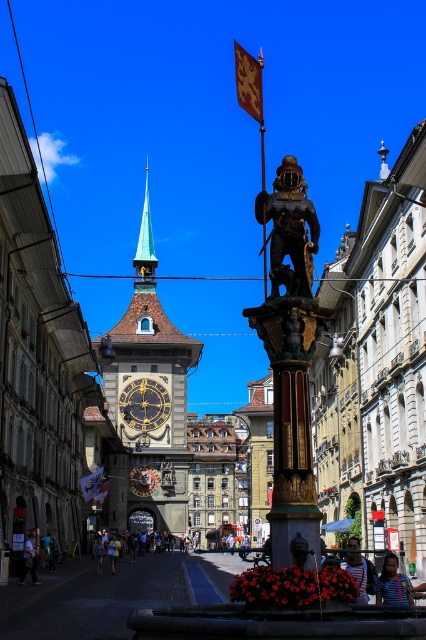
Between gold metallic clock at center and gold metallic flag at center, which one is positioned lower?

gold metallic flag at center is lower down.

The width and height of the screenshot is (426, 640). Find the location of `gold metallic clock at center`. gold metallic clock at center is located at coordinates [x=143, y=404].

I want to click on gold metallic clock at center, so click(143, 404).

Can you confirm if gold-plated clock tower at center is wider than gold polished metal pole at center?

Yes, gold-plated clock tower at center is wider than gold polished metal pole at center.

Does gold-plated clock tower at center have a larger size compared to gold polished metal pole at center?

Yes.

Locate an element on the screen. gold-plated clock tower at center is located at coordinates (147, 401).

Find the location of a particular element. This screenshot has height=640, width=426. gold-plated clock tower at center is located at coordinates (147, 401).

Does point (298, 298) lie in front of point (259, 108)?

Yes, point (298, 298) is closer to viewer.

Does bronze statue at center come behind gold textured flag at upper center?

That is False.

Is point (270, 360) closer to camera compared to point (256, 65)?

Yes, point (270, 360) is in front of point (256, 65).

Locate an element on the screen. Image resolution: width=426 pixels, height=640 pixels. bronze statue at center is located at coordinates (290, 364).